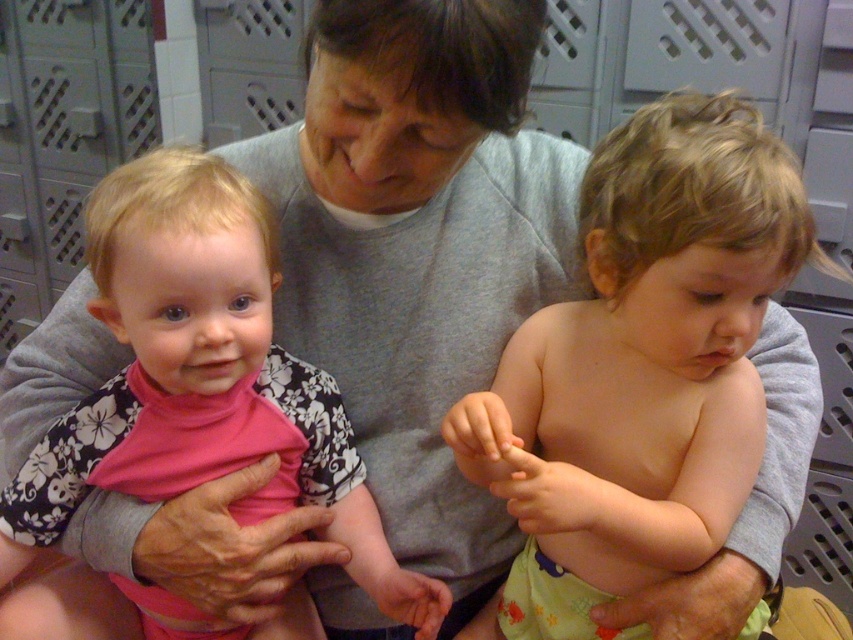
Question: Which point is farther to the camera?

Choices:
 (A) smooth skin toddler at center
 (B) pink fabric toddler at left

Answer: (B)

Question: Can you confirm if smooth skin toddler at center is positioned to the left of pink fabric toddler at left?

Choices:
 (A) yes
 (B) no

Answer: (B)

Question: Can you confirm if smooth skin toddler at center is positioned above pink fabric toddler at left?

Choices:
 (A) yes
 (B) no

Answer: (B)

Question: Can you confirm if smooth skin toddler at center is smaller than pink fabric toddler at left?

Choices:
 (A) no
 (B) yes

Answer: (B)